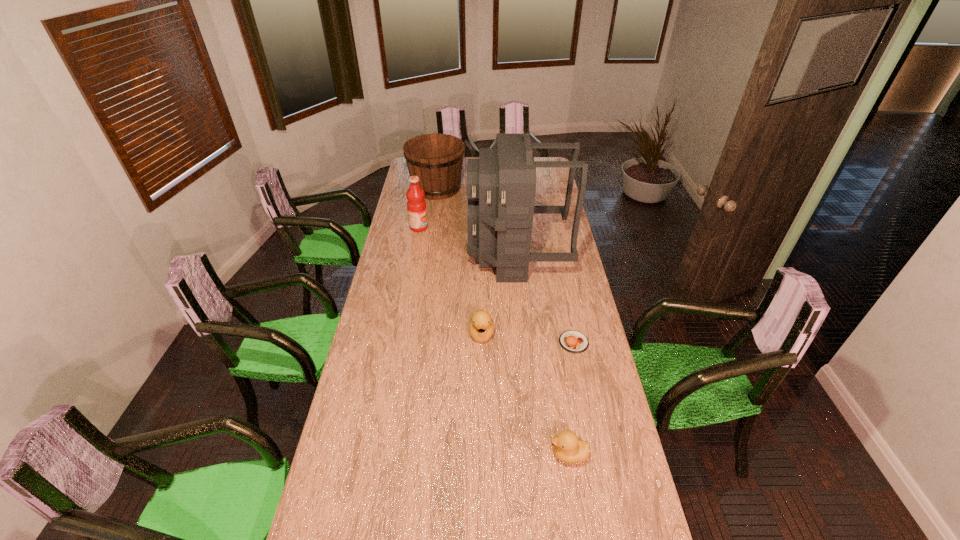
Identify the location of the taller duckling. (481, 327).

This screenshot has height=540, width=960. What are the coordinates of `the third shortest object` in the screenshot? It's located at (481, 327).

Locate an element on the screen. This screenshot has width=960, height=540. the nearer duckling is located at coordinates (567, 448).

Locate an element on the screen. the nearest object is located at coordinates (567, 448).

Identify the location of wine bucket. (437, 159).

Where is `backpack`? The width and height of the screenshot is (960, 540). backpack is located at coordinates (501, 184).

The height and width of the screenshot is (540, 960). What are the coordinates of `fruit juice` in the screenshot? It's located at (416, 206).

You are a GUI agent. You are given a task and a screenshot of the screen. Output one action in this format:
    pyautogui.click(x=<x>, y=<y>)
    Task: Click on the shortest object
    This screenshot has height=540, width=960.
    Given the screenshot: What is the action you would take?
    pyautogui.click(x=572, y=341)

Image resolution: width=960 pixels, height=540 pixels. I want to click on vacant region located facing forward on the left duckling, so (482, 434).

Find the location of a particular element. free space located facing forward on the nearest object is located at coordinates (514, 455).